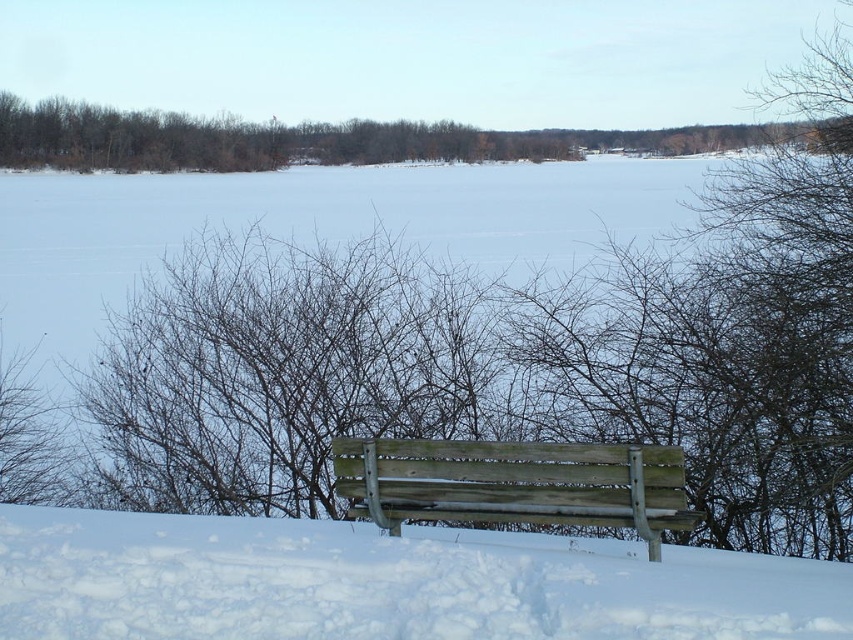
Question: Which point is closer to the camera?

Choices:
 (A) (33, 557)
 (B) (381, 124)

Answer: (A)

Question: Does white fluffy snow at lower center have a greater width compared to brown/dry wood trees at upper center?

Choices:
 (A) no
 (B) yes

Answer: (A)

Question: Which of the following is the closest to the observer?

Choices:
 (A) (666, 499)
 (B) (235, 145)

Answer: (A)

Question: Which point is farther to the camera?

Choices:
 (A) white fluffy snow at lower center
 (B) brown/dry wood trees at upper center
 (C) weathered wood bench at center

Answer: (B)

Question: Is brown/dry wood trees at upper center positioned before weathered wood bench at center?

Choices:
 (A) no
 (B) yes

Answer: (A)

Question: Is brown/dry wood trees at upper center to the left of weathered wood bench at center from the viewer's perspective?

Choices:
 (A) yes
 (B) no

Answer: (A)